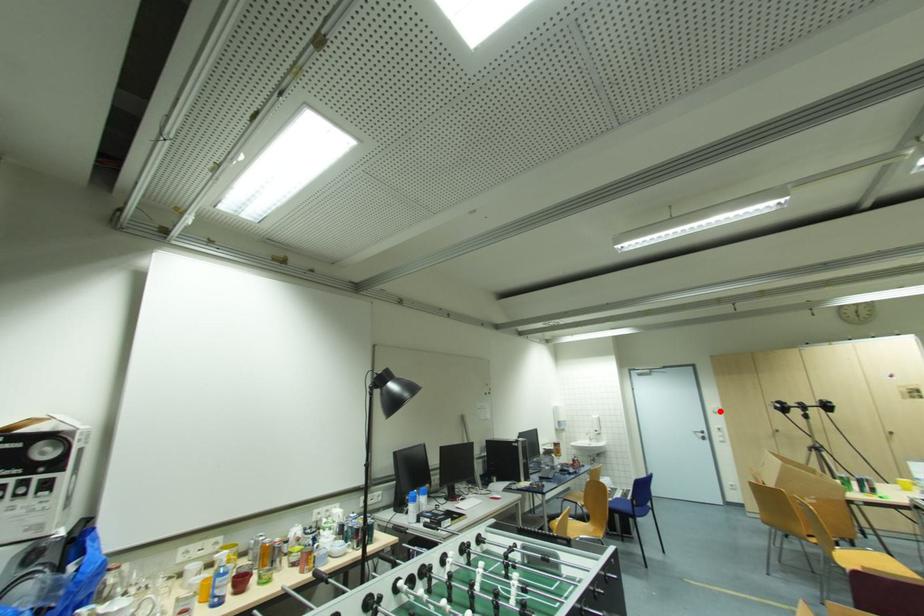
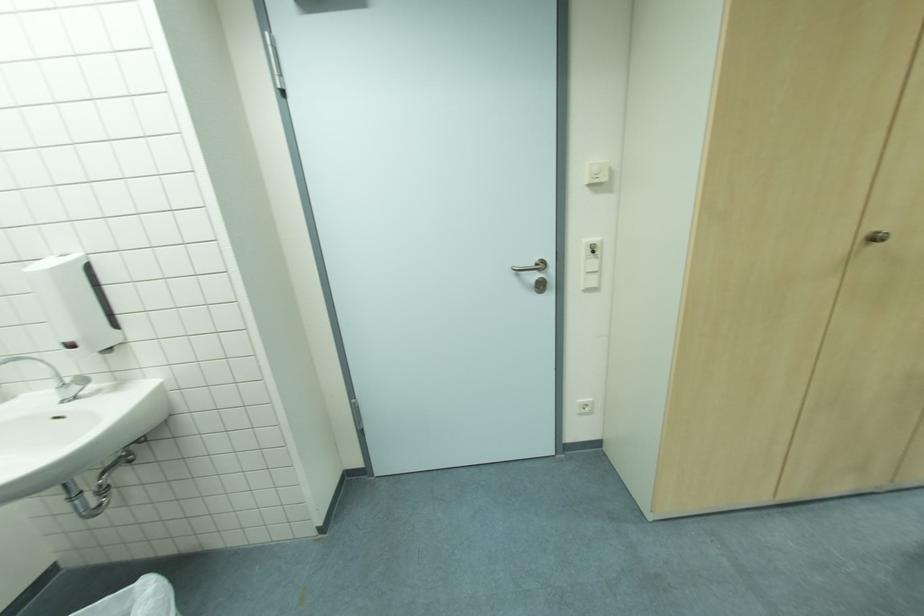
In the second image, find the point that corresponds to the highlighted location in the first image.

(608, 179)